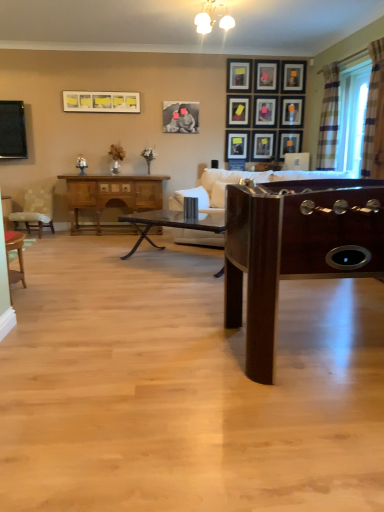
You are a GUI agent. You are given a task and a screenshot of the screen. Output one action in this format:
    pyautogui.click(x=<x>, y=<y>)
    Task: Click on the vacant space underneath shiny dark wood foosball table at right (from a real-world perspective)
    Image resolution: width=384 pixels, height=512 pixels.
    Given the screenshot: What is the action you would take?
    pyautogui.click(x=326, y=346)